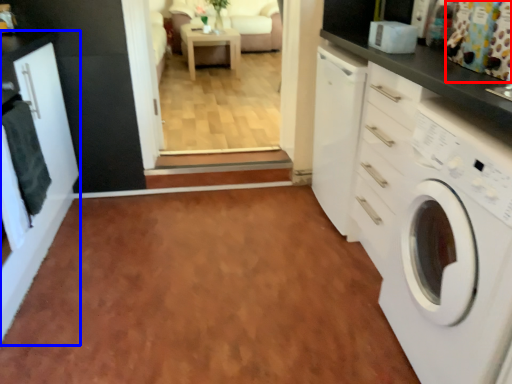
Question: Among these objects, which one is nearest to the camera, curtain (highlighted by a red box) or cabinetry (highlighted by a blue box)?

Choices:
 (A) curtain
 (B) cabinetry

Answer: (B)